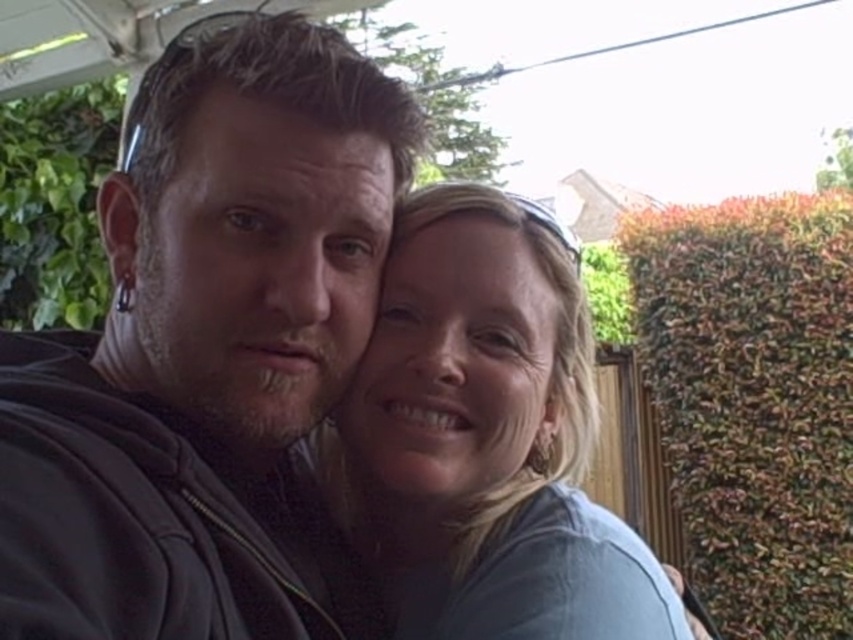
Question: Is leather jacket at center smaller than light blue fabric at center?

Choices:
 (A) yes
 (B) no

Answer: (B)

Question: Does leather jacket at center have a lesser width compared to light blue fabric at center?

Choices:
 (A) no
 (B) yes

Answer: (B)

Question: Which point is farther to the camera?

Choices:
 (A) (355, 540)
 (B) (49, 396)

Answer: (A)

Question: Which object is closer to the camera taking this photo?

Choices:
 (A) leather jacket at center
 (B) light blue fabric at center

Answer: (A)

Question: Can you confirm if leather jacket at center is positioned to the left of light blue fabric at center?

Choices:
 (A) no
 (B) yes

Answer: (B)